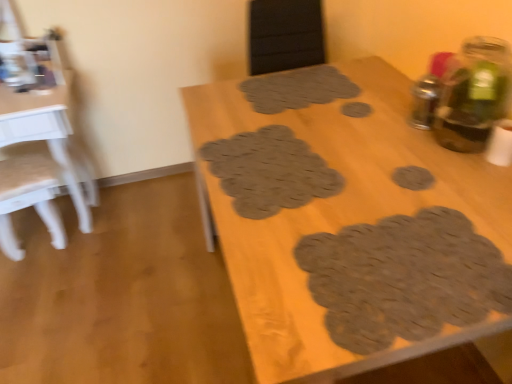
In order to click on vacant space behind brown textured mat at bottom right, marked as the fifth footprint in a top-to-bottom arrangement in this screenshot , I will do `click(388, 185)`.